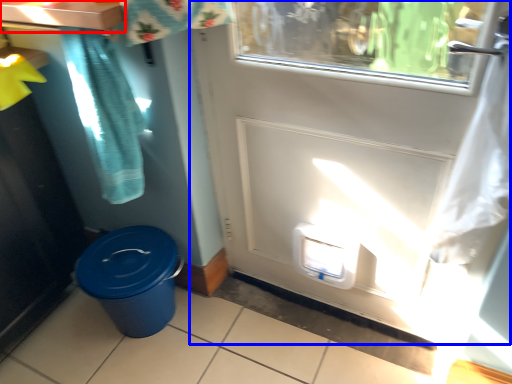
Question: Which of the following is the farthest to the observer, counter top (highlighted by a red box) or door (highlighted by a blue box)?

Choices:
 (A) counter top
 (B) door

Answer: (A)